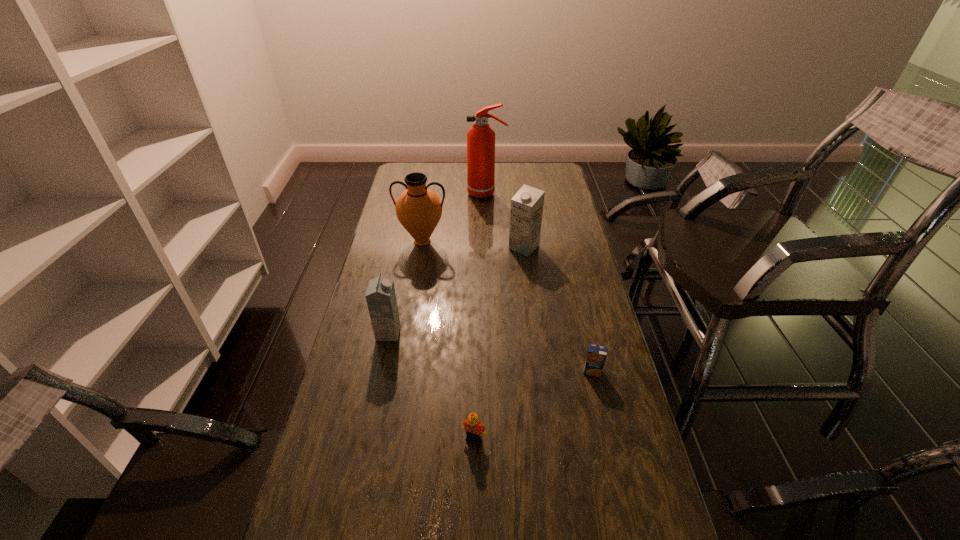
Where is `vacant point located between the farther carton and the orange_juice`? Image resolution: width=960 pixels, height=540 pixels. vacant point located between the farther carton and the orange_juice is located at coordinates (558, 309).

Locate an element on the screen. unoccupied position between the Lego and the nearer carton is located at coordinates (431, 386).

Image resolution: width=960 pixels, height=540 pixels. Find the location of `free space that is in between the left carton and the pitcher`. free space that is in between the left carton and the pitcher is located at coordinates tap(405, 287).

Point out which object is positioned as the fifth nearest to the nearest object. Please provide its 2D coordinates. Your answer should be formatted as a tuple, i.e. [(x, y)], where the tuple contains the x and y coordinates of a point satisfying the conditions above.

[(480, 138)]

Identify the location of object that is the closest one to the Lego. Image resolution: width=960 pixels, height=540 pixels. (596, 356).

Where is `vacant space that satisfies the following two spatial constraints: 1. at the nozzle of the tallest object; 2. on the right side of the farther carton`? The width and height of the screenshot is (960, 540). vacant space that satisfies the following two spatial constraints: 1. at the nozzle of the tallest object; 2. on the right side of the farther carton is located at coordinates (488, 247).

Where is `blank area in the image that satisfies the following two spatial constraints: 1. at the nozzle of the tallest object; 2. on the front-facing side of the nearest object`? The width and height of the screenshot is (960, 540). blank area in the image that satisfies the following two spatial constraints: 1. at the nozzle of the tallest object; 2. on the front-facing side of the nearest object is located at coordinates (492, 438).

Identify the location of vacant space that satisfies the following two spatial constraints: 1. on the front side of the farther carton; 2. on the front label of the nearer carton. The height and width of the screenshot is (540, 960). (535, 333).

This screenshot has height=540, width=960. In order to click on free space that satisfies the following two spatial constraints: 1. at the nozzle of the second nearest object; 2. on the right side of the farthest object in this screenshot , I will do `click(491, 372)`.

Where is `free location that satisfies the following two spatial constraints: 1. on the front side of the pitcher; 2. on the front label of the third nearest object`? free location that satisfies the following two spatial constraints: 1. on the front side of the pitcher; 2. on the front label of the third nearest object is located at coordinates (407, 333).